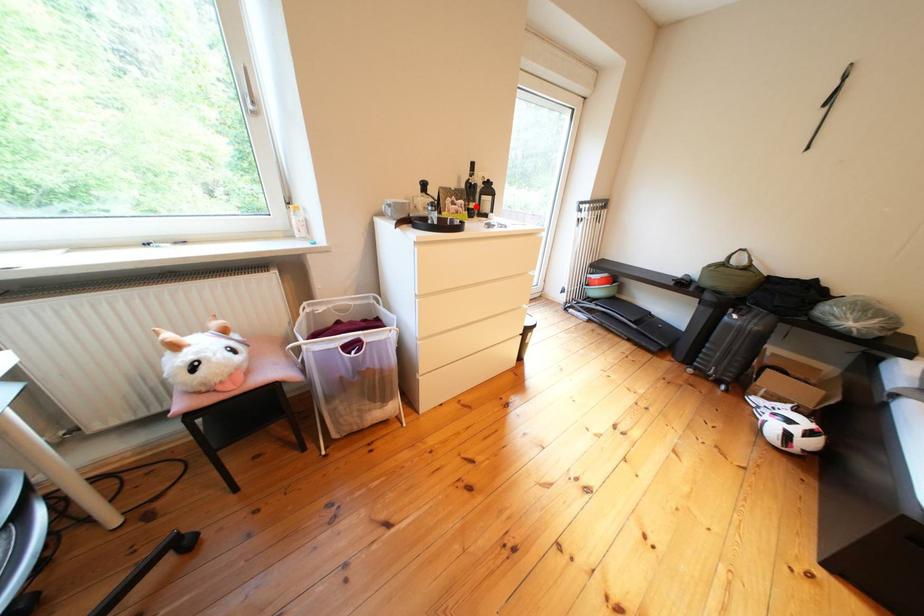
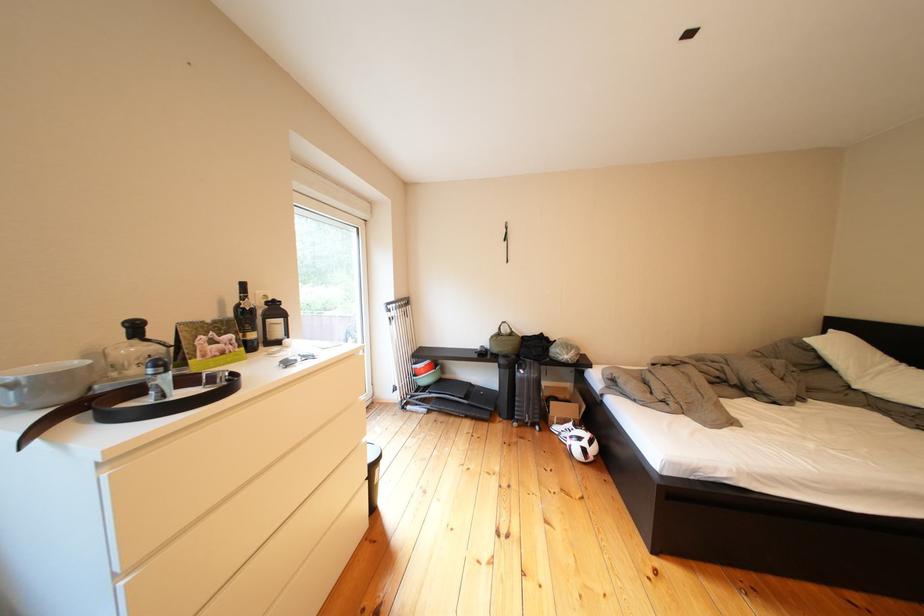
The point at the highlighted location is marked in the first image. Where is the corresponding point in the second image?

(245, 341)